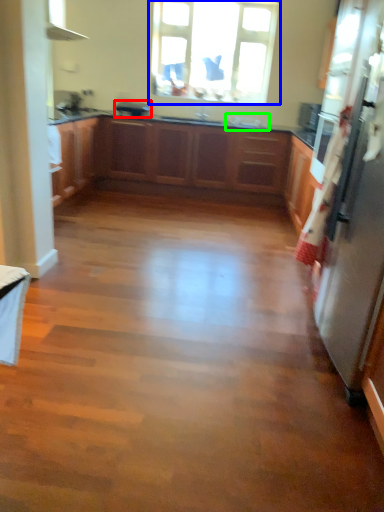
Question: Considering the real-world distances, which object is farthest from appliance (highlighted by a red box)? window (highlighted by a blue box) or sink (highlighted by a green box)?

Choices:
 (A) window
 (B) sink

Answer: (B)